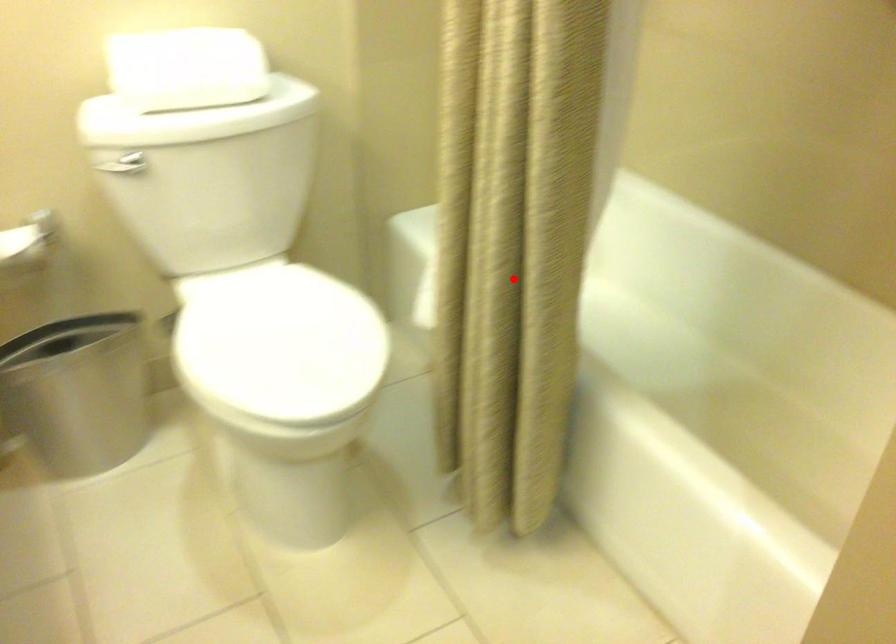
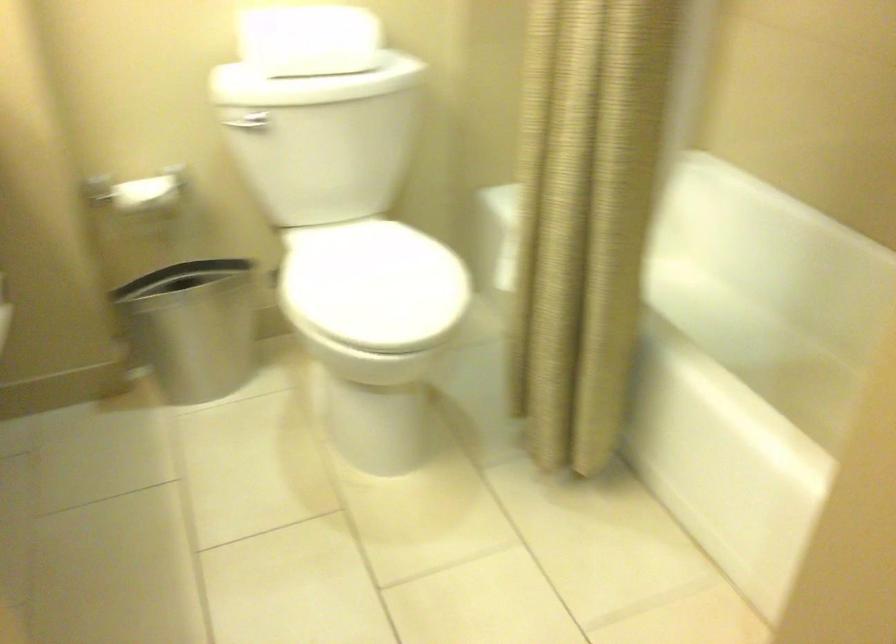
Locate, in the second image, the point that corresponds to the highlighted location in the first image.

(583, 230)